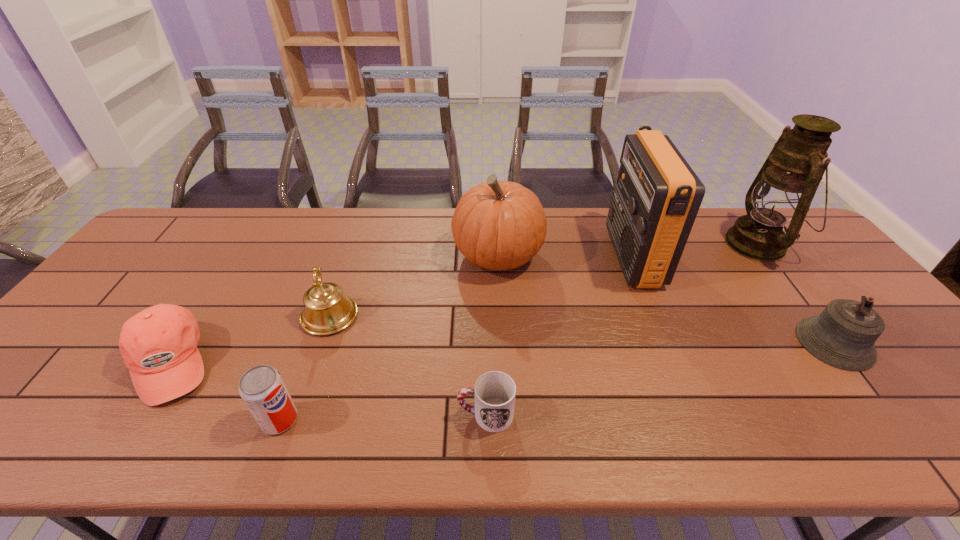
Locate an element on the screen. the tallest object is located at coordinates (784, 188).

Locate an element on the screen. This screenshot has height=540, width=960. the sixth object from left to right is located at coordinates pyautogui.click(x=654, y=204).

Locate an element on the screen. radio receiver is located at coordinates (654, 204).

Locate an element on the screen. The image size is (960, 540). pumpkin is located at coordinates (498, 225).

The image size is (960, 540). Identify the location of the left bell. (327, 311).

The height and width of the screenshot is (540, 960). Find the location of `the right bell`. the right bell is located at coordinates pyautogui.click(x=843, y=335).

Locate an element on the screen. soda is located at coordinates (262, 388).

Identify the location of baseball cap. The image size is (960, 540). (159, 344).

Identify the location of the shortest object. This screenshot has width=960, height=540. (494, 392).

You are a GUI agent. You are given a task and a screenshot of the screen. Output one action in this format:
    pyautogui.click(x=<x>, y=<y>)
    Task: Click on the vacant space located on the left of the oil lamp
    Image resolution: width=960 pixels, height=540 pixels.
    Given the screenshot: What is the action you would take?
    pyautogui.click(x=641, y=244)